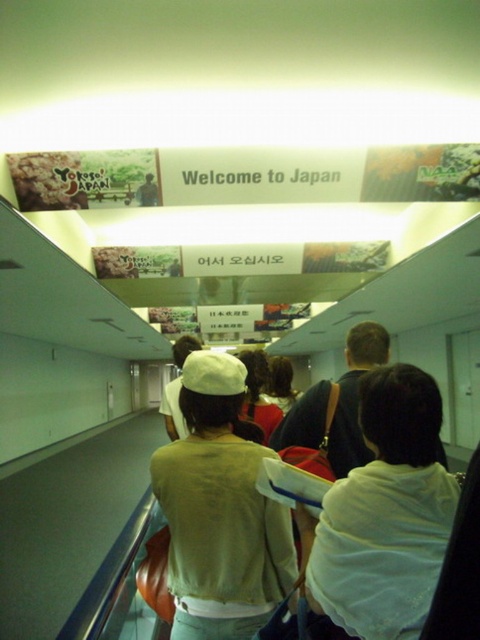
Question: Is white fabric shirt at center to the right of light beige sweater at center from the viewer's perspective?

Choices:
 (A) yes
 (B) no

Answer: (A)

Question: Is white fabric shirt at center behind light beige sweater at center?

Choices:
 (A) no
 (B) yes

Answer: (A)

Question: Is white fabric shirt at center wider than light beige sweater at center?

Choices:
 (A) yes
 (B) no

Answer: (B)

Question: Which point is closer to the camera taking this photo?

Choices:
 (A) (193, 400)
 (B) (375, 490)

Answer: (B)